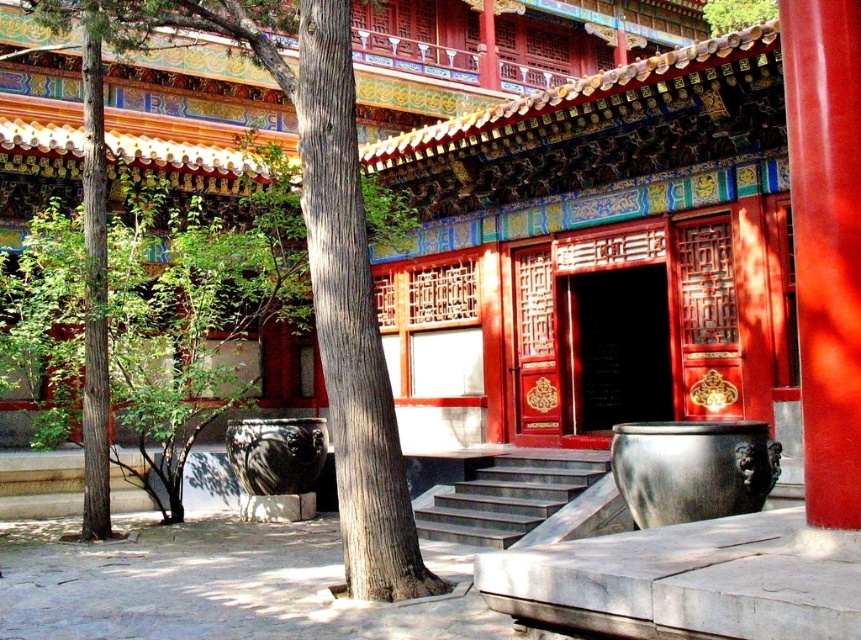
Question: Which object appears farthest from the camera in this image?

Choices:
 (A) smooth glossy red pillar at center
 (B) brown textured tree at center

Answer: (B)

Question: From the image, what is the correct spatial relationship of brown textured tree at center in relation to dark gray stone stairs at center?

Choices:
 (A) left
 (B) right

Answer: (A)

Question: Based on their relative distances, which object is nearer to the smooth glossy red pillar at center?

Choices:
 (A) brown textured tree at center
 (B) dark gray stone stairs at center

Answer: (B)

Question: Does smooth glossy red pillar at center have a smaller size compared to dark gray stone stairs at center?

Choices:
 (A) yes
 (B) no

Answer: (B)

Question: Can you confirm if smooth glossy red pillar at center is wider than dark gray stone stairs at center?

Choices:
 (A) no
 (B) yes

Answer: (A)

Question: Which point appears farthest from the camera in this image?

Choices:
 (A) pyautogui.click(x=327, y=348)
 (B) pyautogui.click(x=815, y=284)
 (C) pyautogui.click(x=570, y=474)

Answer: (C)